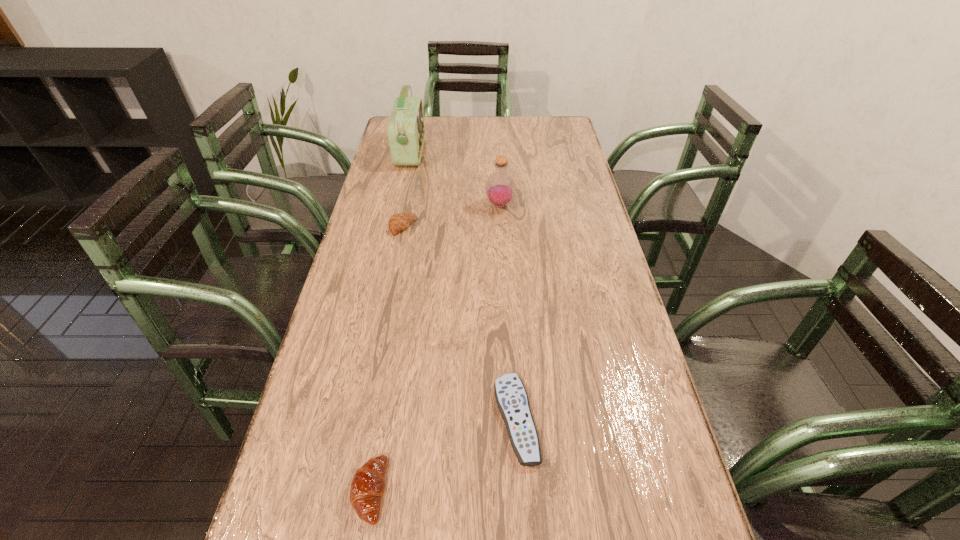
Identify the location of free space between the nearer crescent roll and the remote control. Image resolution: width=960 pixels, height=540 pixels. (443, 455).

Identify the location of vacant space that is in between the nearer crescent roll and the fourth shortest object. The height and width of the screenshot is (540, 960). (435, 348).

I want to click on vacant area that lies between the radio receiver and the shortest object, so click(x=464, y=286).

Identify the location of free space between the nearer crescent roll and the tallest object. The height and width of the screenshot is (540, 960). (390, 321).

Find the location of a particular element. The width and height of the screenshot is (960, 540). vacant area between the nearer crescent roll and the third farthest object is located at coordinates (386, 359).

At what (x,y) coordinates should I click in order to perform the action: click on empty location between the farther crescent roll and the radio receiver. Please return your answer as a coordinate pair (x, y). The image size is (960, 540). Looking at the image, I should click on (407, 190).

Identify the location of vacant space that's between the bottle and the farthest object. (455, 179).

The image size is (960, 540). What are the coordinates of `free point between the remote control and the farthest object` in the screenshot? It's located at pos(464,286).

I want to click on vacant space that's between the fourth shortest object and the shortest object, so click(x=508, y=312).

Where is `free space that is in between the nearer crescent roll and the remote control`? The image size is (960, 540). free space that is in between the nearer crescent roll and the remote control is located at coordinates (443, 455).